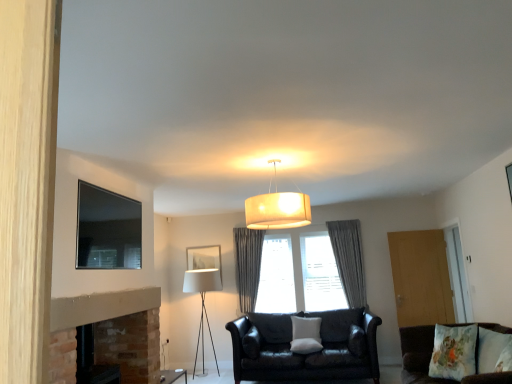
Question: Considering the positions of point (490, 360) and point (305, 258), is point (490, 360) closer or farther from the camera than point (305, 258)?

Choices:
 (A) farther
 (B) closer

Answer: (B)

Question: Is fluffy floral pillow at lower right, which is the 1th pillow in right-to-left order, spatially inside gray fabric curtain at center, or outside of it?

Choices:
 (A) inside
 (B) outside

Answer: (B)

Question: Which is nearer to the matte black couch at center, the first studio couch viewed from the back?

Choices:
 (A) matte white fabric lampshade at center
 (B) matte black tv at upper left, the second picture frame ordered from the bottom
 (C) gray fabric curtain at center, positioned as the first curtain in left-to-right order
 (D) wooden door at right, which is the first glass door from left to right
 (E) transparent glass door at right, which ranks as the second glass door in left-to-right order

Answer: (C)

Question: Considering the real-world distances, which object is farthest from the gray fabric curtain at center, which is counted as the first curtain, starting from the right?

Choices:
 (A) velvet brown couch at lower right, which is counted as the 2th studio couch, starting from the back
 (B) transparent glass door at right, which ranks as the first glass door in right-to-left order
 (C) gray fabric curtain at center, positioned as the first curtain in left-to-right order
 (D) matte black side table at lower left
 (E) white fabric lampshade at lower left

Answer: (D)